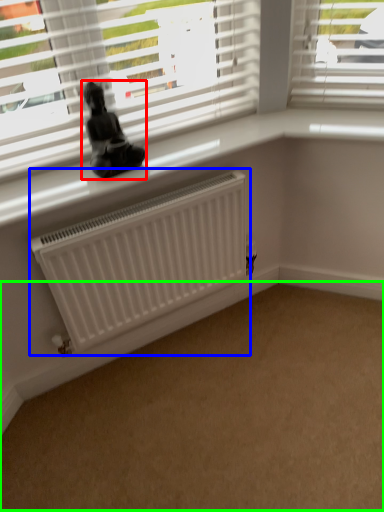
Question: Estimate the real-world distances between objects in this image. Which object is closer to miniature (highlighted by a red box), radiator (highlighted by a blue box) or plain (highlighted by a green box)?

Choices:
 (A) radiator
 (B) plain

Answer: (A)